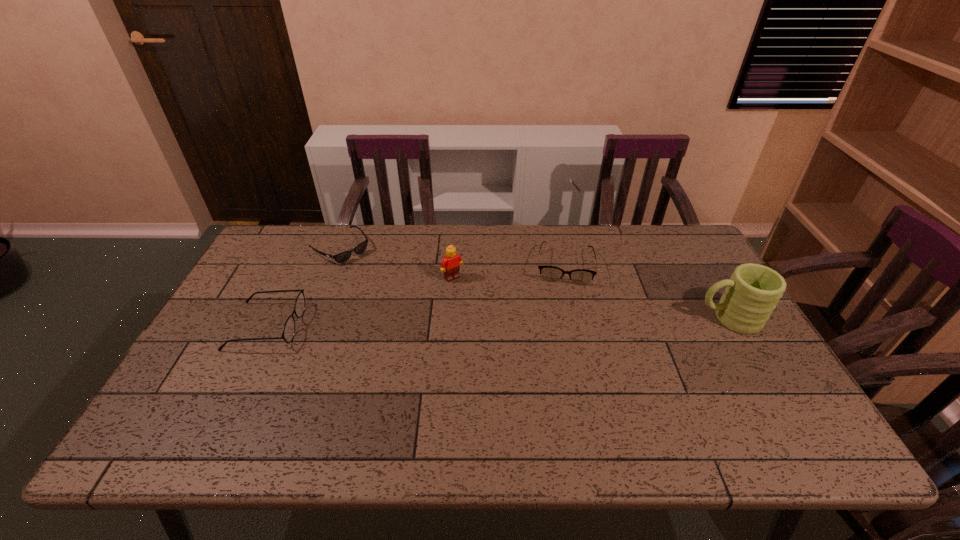
Choose which object is the nearest neighbor to the tallest object. Please provide its 2D coordinates. Your answer should be formatted as a tuple, i.e. [(x, y)], where the tuple contains the x and y coordinates of a point satisfying the conditions above.

[(548, 273)]

Identify the location of object that is the fourth nearest to the tallest object. Image resolution: width=960 pixels, height=540 pixels. (288, 332).

Where is `vacant space that satisfies the following two spatial constraints: 1. on the front side of the rightmost object; 2. on the side of the shortest object with the handle`? The width and height of the screenshot is (960, 540). vacant space that satisfies the following two spatial constraints: 1. on the front side of the rightmost object; 2. on the side of the shortest object with the handle is located at coordinates (313, 319).

This screenshot has height=540, width=960. I want to click on blank space that satisfies the following two spatial constraints: 1. on the back side of the right spectacles; 2. on the right side of the Lego, so click(x=453, y=266).